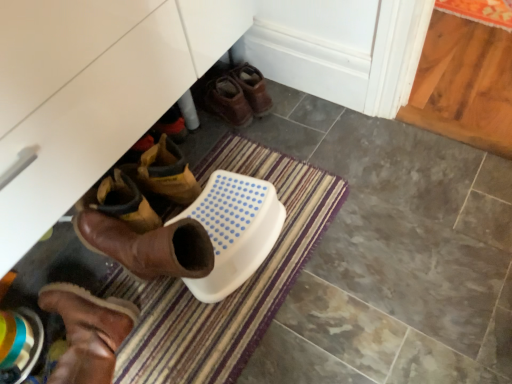
Question: Is brown leather boots at center, the 2th footwear when ordered from left to right, inside or outside of striped carpet at lower center?

Choices:
 (A) outside
 (B) inside

Answer: (A)

Question: Would you say brown leather boots at center, the second footwear when ordered from front to back, is to the left or to the right of striped carpet at lower center in the picture?

Choices:
 (A) right
 (B) left

Answer: (A)

Question: Based on their relative distances, which object is nearer to the brown leather boots at center, the second footwear when ordered from front to back?

Choices:
 (A) brown suede boot at lower left, the first footwear from the bottom
 (B) striped carpet at lower center

Answer: (B)

Question: Which object is the farthest from the striped carpet at lower center?

Choices:
 (A) brown suede boot at lower left, which is the second footwear in top-to-bottom order
 (B) brown leather boots at center, placed as the first footwear when sorted from right to left

Answer: (B)